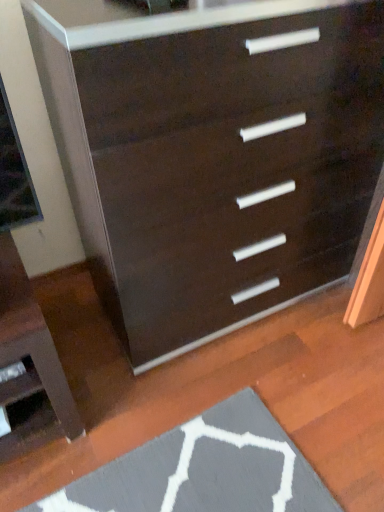
This screenshot has width=384, height=512. I want to click on matte black dresser at center, so click(213, 154).

In the scene shown: What is the approximate height of matte black dresser at center?

3.44 feet.

Image resolution: width=384 pixels, height=512 pixels. Describe the element at coordinates (213, 154) in the screenshot. I see `matte black dresser at center` at that location.

Locate an element on the screen. This screenshot has width=384, height=512. matte black dresser at center is located at coordinates coord(213,154).